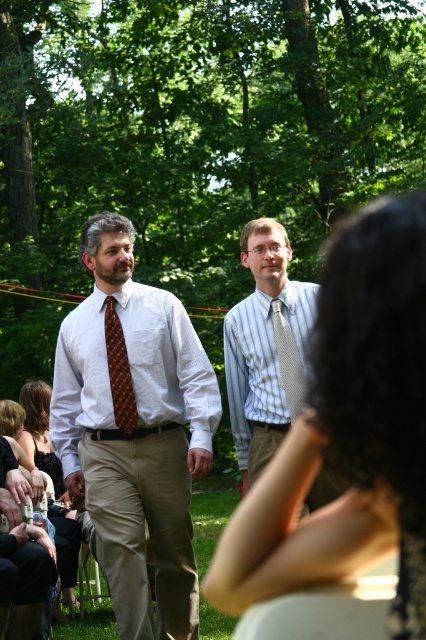
Question: Does matte khaki pants at center have a smaller size compared to striped cotton shirt at center?

Choices:
 (A) no
 (B) yes

Answer: (B)

Question: Which object is closer to the camera taking this photo?

Choices:
 (A) brown woven tie at center
 (B) silver textured tie at center
 (C) striped cotton shirt at center
 (D) matte brown tie at center

Answer: (D)

Question: Which of the following is the closest to the observer?

Choices:
 (A) (115, 413)
 (B) (172, 356)

Answer: (A)

Question: Can you confirm if matte khaki pants at center is positioned above brown woven tie at center?

Choices:
 (A) no
 (B) yes

Answer: (A)

Question: Among these objects, which one is farthest from the camera?

Choices:
 (A) white woven shirt at left
 (B) brown woven tie at center
 (C) silver textured tie at center
 (D) matte khaki pants at center

Answer: (A)

Question: Can you confirm if matte khaki pants at center is positioned to the right of striped cotton shirt at center?

Choices:
 (A) yes
 (B) no

Answer: (B)